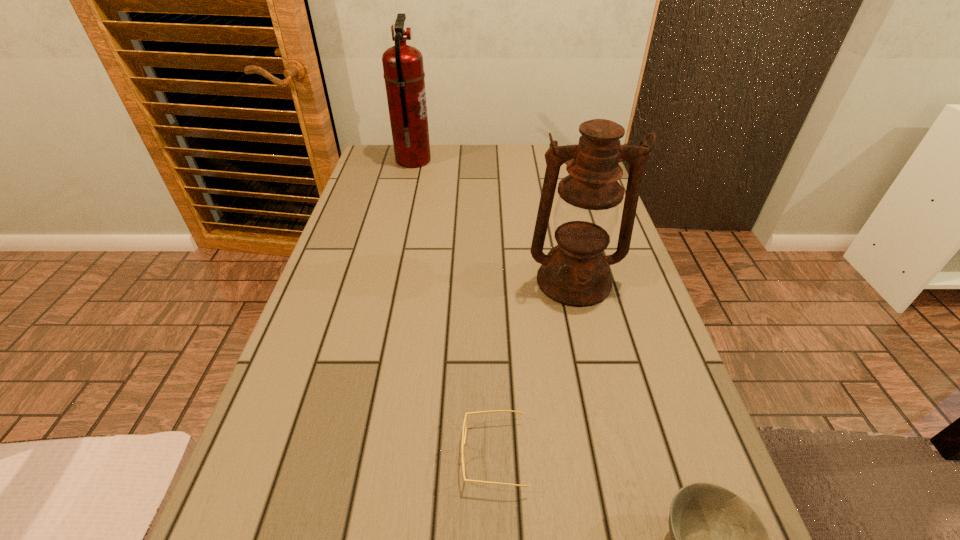
Locate an element on the screen. The width and height of the screenshot is (960, 540). the farthest object is located at coordinates (403, 68).

Where is `the leftmost object`? The image size is (960, 540). the leftmost object is located at coordinates (403, 68).

Find the location of a particular element. oil lamp is located at coordinates (576, 273).

Where is `the third object from right to left`? the third object from right to left is located at coordinates (465, 423).

The image size is (960, 540). I want to click on spectacles, so click(x=465, y=423).

In order to click on vacant region located on the nozzle side of the farthest object in this screenshot , I will do `click(508, 160)`.

Image resolution: width=960 pixels, height=540 pixels. I want to click on free space located on the back of the third nearest object, so click(x=553, y=191).

Identify the location of vacant space located 0.270m in front of the lenses of the second object from left to right. (300, 455).

Locate an element on the screen. This screenshot has width=960, height=540. free space located in front of the lenses of the second object from left to right is located at coordinates (305, 455).

The width and height of the screenshot is (960, 540). What are the coordinates of `free space located in front of the lenses of the second object from left to right` in the screenshot? It's located at (263, 455).